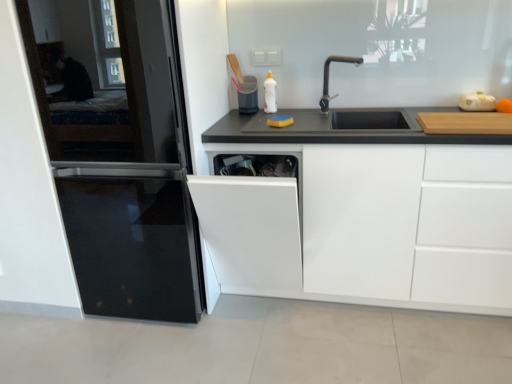
Question: Are white plastic cutting board at upper right, the second appliance in the left-to-right sequence, and white glossy bottle at upper center far apart?

Choices:
 (A) yes
 (B) no

Answer: (B)

Question: From a real-world perspective, is white plastic cutting board at upper right, which is the 1th appliance from front to back, physically above white glossy bottle at upper center?

Choices:
 (A) no
 (B) yes

Answer: (A)

Question: Does white plastic cutting board at upper right, which is counted as the second appliance, starting from the back, come in front of white glossy bottle at upper center?

Choices:
 (A) no
 (B) yes

Answer: (B)

Question: Is white plastic cutting board at upper right, the second appliance in the left-to-right sequence, aimed at white glossy bottle at upper center?

Choices:
 (A) yes
 (B) no

Answer: (B)

Question: Considering the relative sizes of white plastic cutting board at upper right, which is counted as the second appliance, starting from the back, and white glossy bottle at upper center in the image provided, is white plastic cutting board at upper right, which is counted as the second appliance, starting from the back, shorter than white glossy bottle at upper center?

Choices:
 (A) yes
 (B) no

Answer: (A)

Question: From a real-world perspective, is white matte cabinet at center positioned above or below white plastic cutting board at upper right, which is counted as the second appliance, starting from the back?

Choices:
 (A) below
 (B) above

Answer: (A)

Question: In the image, is white matte cabinet at center positioned in front of or behind white plastic cutting board at upper right, marked as the first appliance in a right-to-left arrangement?

Choices:
 (A) front
 (B) behind

Answer: (A)

Question: From the image's perspective, is white matte cabinet at center above or below white plastic cutting board at upper right, the second appliance in the left-to-right sequence?

Choices:
 (A) below
 (B) above

Answer: (A)

Question: In the image, is white matte cabinet at center on the left side or the right side of white plastic cutting board at upper right, which is counted as the second appliance, starting from the back?

Choices:
 (A) left
 (B) right

Answer: (A)

Question: Relative to white glossy bottle at upper center, is white plastic cutting board at upper right, which is counted as the second appliance, starting from the back, in front or behind?

Choices:
 (A) front
 (B) behind

Answer: (A)

Question: Is point (478, 102) positioned closer to the camera than point (266, 109)?

Choices:
 (A) closer
 (B) farther

Answer: (A)

Question: Visually, is white plastic cutting board at upper right, which is the 1th appliance from front to back, positioned to the left or to the right of white glossy bottle at upper center?

Choices:
 (A) right
 (B) left

Answer: (A)

Question: In terms of width, does white plastic cutting board at upper right, the second appliance in the left-to-right sequence, look wider or thinner when compared to white glossy bottle at upper center?

Choices:
 (A) thin
 (B) wide

Answer: (A)

Question: Based on their positions, is white glossy bottle at upper center located to the left or right of white glossy dishwasher at center?

Choices:
 (A) right
 (B) left

Answer: (A)

Question: Is white glossy bottle at upper center wider or thinner than white glossy dishwasher at center?

Choices:
 (A) wide
 (B) thin

Answer: (B)